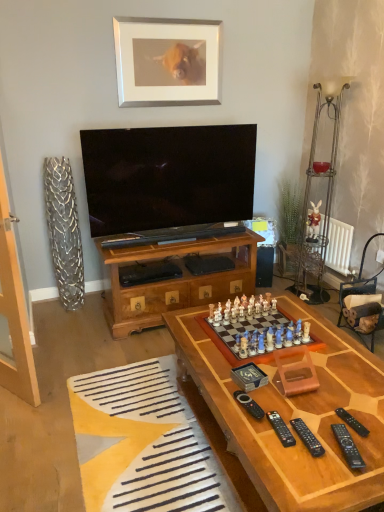
Locate an element on the screen. free space above white radiator at right (from a real-world perspective) is located at coordinates (334, 219).